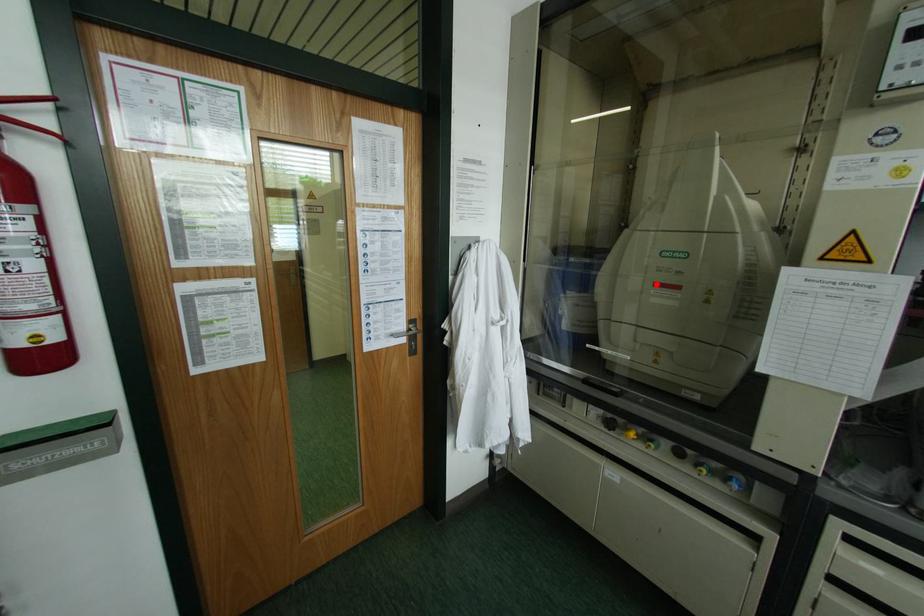
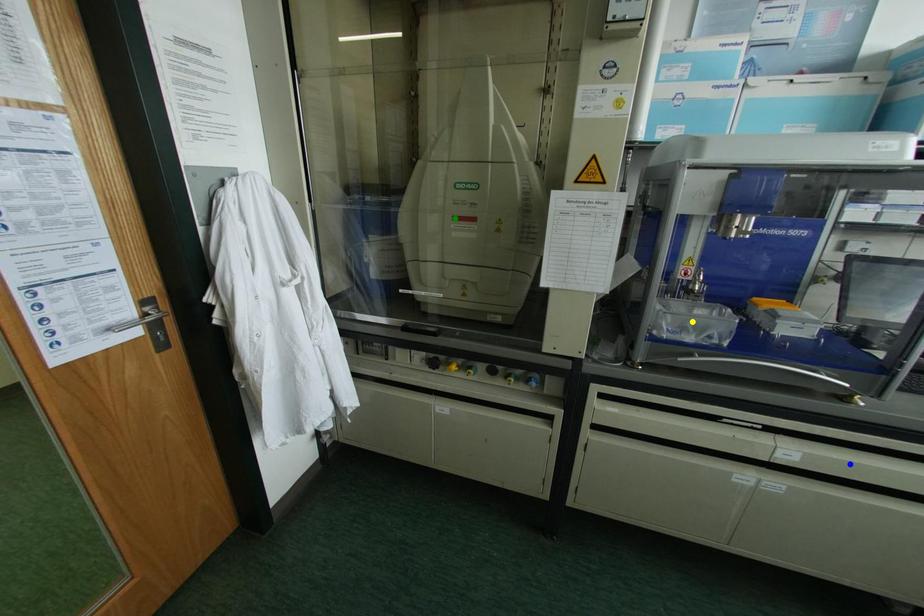
Question: I am providing you with two images of the same scene from different viewpoints. A red point is marked on the first image. You are given multiple points on the second image. Which point in image 2 represents the same 3d spot as the red point in image 1?

Choices:
 (A) blue point
 (B) yellow point
 (C) green point

Answer: (C)